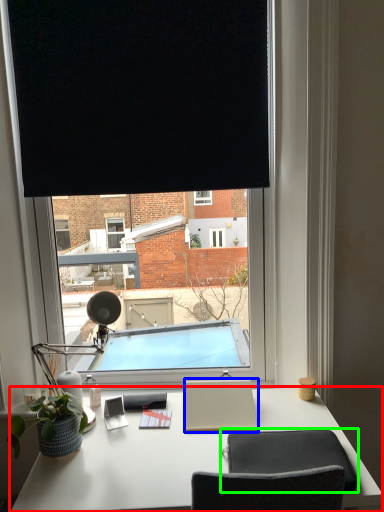
Question: Considering the real-world distances, which object is farthest from desk (highlighted by a red box)? notepad (highlighted by a blue box) or computer chair (highlighted by a green box)?

Choices:
 (A) notepad
 (B) computer chair

Answer: (B)